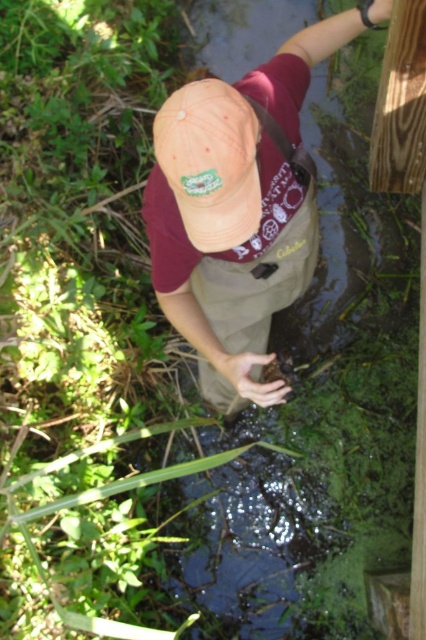
You are a photographer trying to capture the tan canvas hat at upper center in the center of your camera frame. Given its current position at point 0.328 on the x axis and 0.561 on the y axis, will you need to adjust your camera to the left or right to center the hat?

The tan canvas hat at upper center is located at point 0.328 on the x axis and 0.561 on the y axis. To center it in the camera frame, you would need to adjust the camera to the left since the x coordinate is less than 0.5, indicating it is positioned to the left of the center.

You are a photographer trying to capture the scene of the person in the water. You want to ensure that both the tan canvas hat at upper center and the khaki fabric at center are clearly visible in your shot. Given their sizes, which object should you focus on first to ensure it fits within the frame?

The tan canvas hat at upper center has a larger width than the khaki fabric at center, so you should focus on ensuring the tan canvas hat at upper center fits first since it requires more space in the frame.

You are a wildlife photographer aiming to capture the person in the image without getting your camera wet. The matte orange cap at center and khaki fabric at center are both at the center of your viewfinder. Which object should you focus on to ensure your camera remains above the water level?

The matte orange cap at center is shorter than the khaki fabric at center, so focusing on the khaki fabric at center ensures the camera stays above the water level since it is taller.